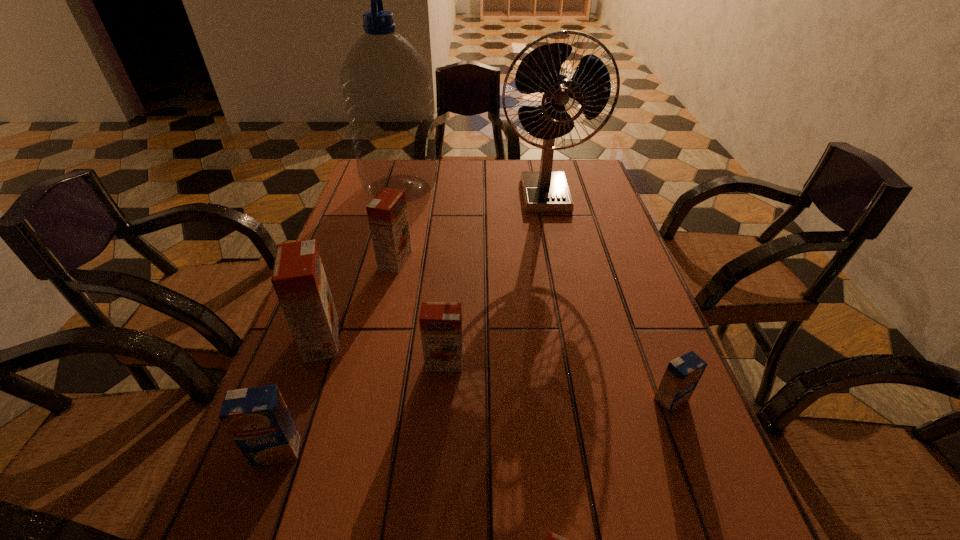
Where is `vacant point that satisfies the following two spatial constraints: 1. on the back side of the third biggest orange orange juice; 2. on the right side of the bigger blue orange_juice`? vacant point that satisfies the following two spatial constraints: 1. on the back side of the third biggest orange orange juice; 2. on the right side of the bigger blue orange_juice is located at coordinates (309, 362).